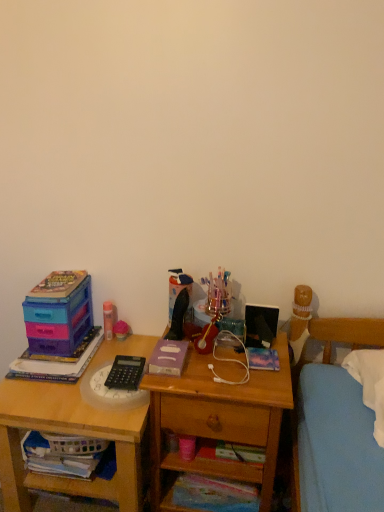
You are a GUI agent. You are given a task and a screenshot of the screen. Output one action in this format:
    pyautogui.click(x=<x>, y=<y>)
    Task: Click on the free spot in front of matte plastic toy at center
    The height and width of the screenshot is (512, 384).
    Given the screenshot: What is the action you would take?
    pyautogui.click(x=94, y=358)